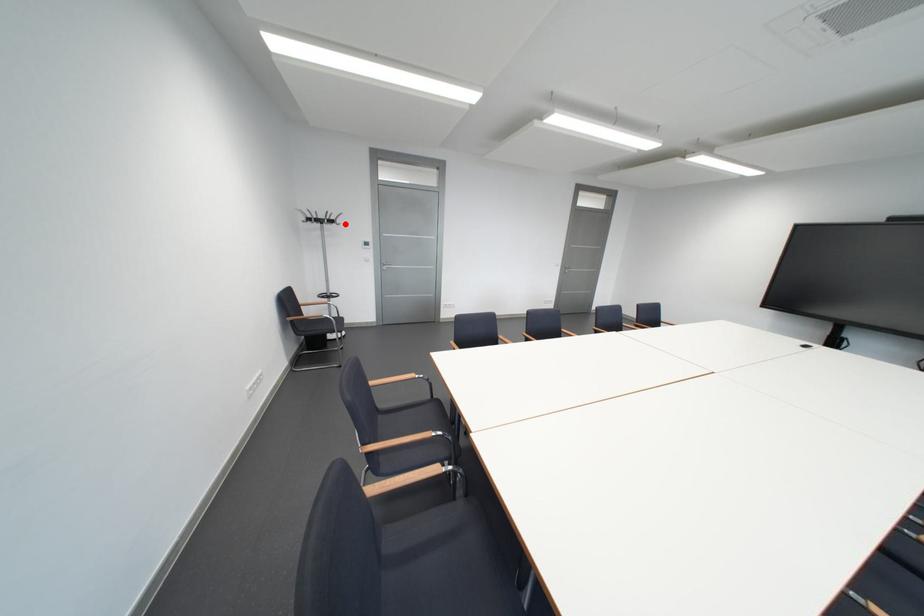
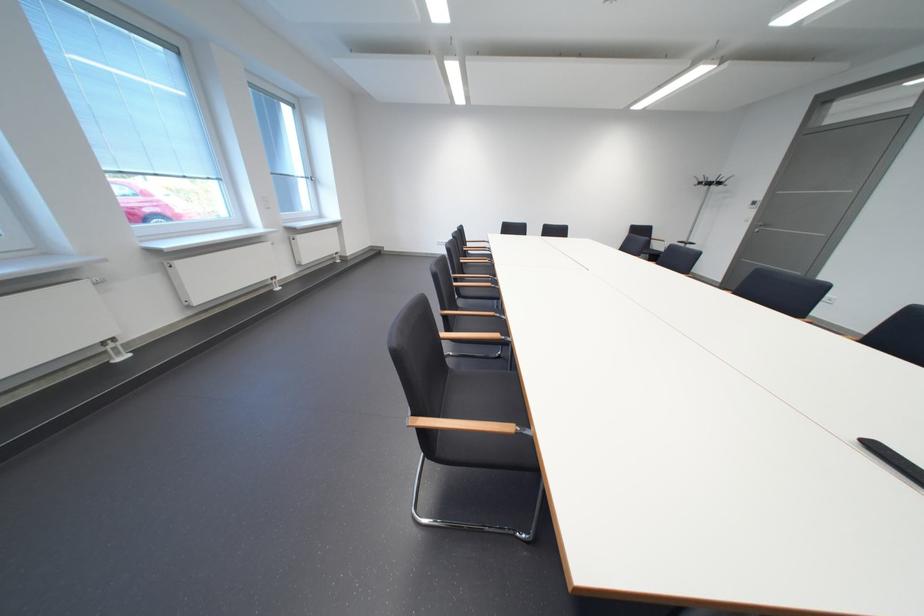
In the second image, find the point that corresponds to the highlighted location in the first image.

(723, 185)